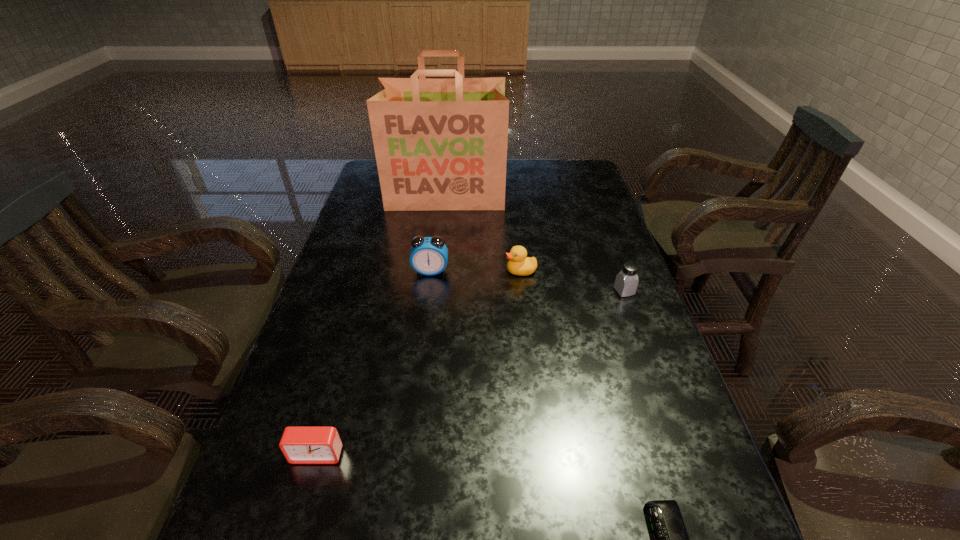
At what (x,y) coordinates should I click in order to perform the action: click on the tallest object. Please return your answer as a coordinate pair (x, y). This screenshot has height=540, width=960. Looking at the image, I should click on 440,144.

Where is `grocery bag`? grocery bag is located at coordinates (440, 144).

Where is `the farthest alarm clock`? Image resolution: width=960 pixels, height=540 pixels. the farthest alarm clock is located at coordinates (429, 255).

The width and height of the screenshot is (960, 540). I want to click on the tallest alarm clock, so click(x=429, y=255).

At what (x,y) coordinates should I click in order to perform the action: click on the fourth farthest object. Please return your answer as a coordinate pair (x, y). The height and width of the screenshot is (540, 960). Looking at the image, I should click on (626, 282).

The image size is (960, 540). I want to click on the rightmost object, so click(x=626, y=282).

Locate an element on the screen. duckling is located at coordinates (519, 264).

Locate an element on the screen. The height and width of the screenshot is (540, 960). the second nearest object is located at coordinates (300, 445).

Locate an element on the screen. the leftmost alarm clock is located at coordinates (300, 445).

Image resolution: width=960 pixels, height=540 pixels. I want to click on free spot located 0.080m on the front of the tallest object, so click(443, 225).